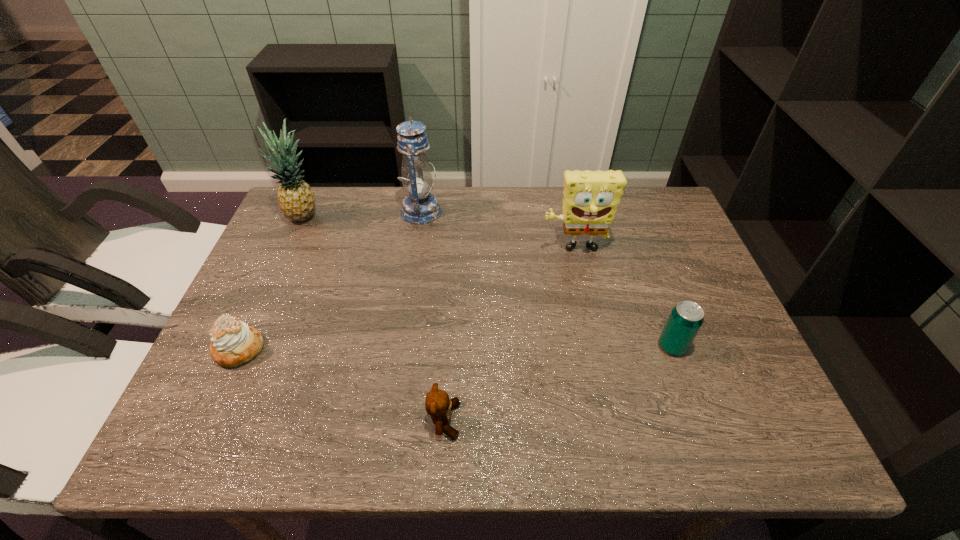
At what (x,y) coordinates should I click in order to perform the action: click on free location located 0.300m on the front of the pineapple. Please return your answer as a coordinate pair (x, y). The image size is (960, 540). Looking at the image, I should click on (264, 306).

The height and width of the screenshot is (540, 960). Identify the location of vacant space located on the face of the fifth object from left to right. (580, 278).

Locate an element on the screen. vacant area situated 0.240m on the left of the beer can is located at coordinates (553, 346).

Identify the location of vacant space located on the front-facing side of the fourth object from left to right. (485, 420).

At what (x,y) coordinates should I click in order to perform the action: click on vacant space located 0.370m on the back of the pastry. Please return your answer as a coordinate pair (x, y). Looking at the image, I should click on (294, 230).

Image resolution: width=960 pixels, height=540 pixels. Identify the location of lantern at the far edge. (420, 206).

You are a GUI agent. You are given a task and a screenshot of the screen. Output one action in this format:
    pyautogui.click(x=<x>, y=<y>)
    Task: Click on the pineapple that is at the far edge
    The width and height of the screenshot is (960, 540).
    Given the screenshot: What is the action you would take?
    point(296,199)

Find the location of `object situated at the near edge`. object situated at the near edge is located at coordinates (437, 404).

The height and width of the screenshot is (540, 960). I want to click on pineapple located in the left edge section of the desktop, so click(x=296, y=199).

Locate an element on the screen. This screenshot has width=960, height=540. pastry positioned at the left edge is located at coordinates (233, 342).